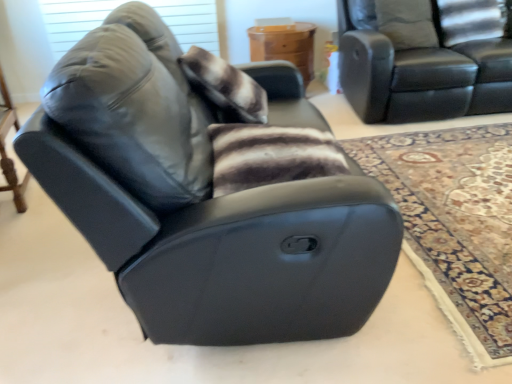
Question: Considering their positions, is matte gray window screen at upper left located in front of or behind black leather couch at upper right?

Choices:
 (A) front
 (B) behind

Answer: (B)

Question: Is matte gray window screen at upper left inside or outside of black leather couch at upper right?

Choices:
 (A) inside
 (B) outside

Answer: (B)

Question: Estimate the real-world distances between objects in this image. Which object is farther from the matte gray window screen at upper left?

Choices:
 (A) black leather recliner at center
 (B) black leather couch at upper right
 (C) carpeted rug at lower right
 (D) brown fur blanket at center
 (E) fuzzy brown pillow at upper center

Answer: (A)

Question: Based on their relative distances, which object is farther from the matte gray window screen at upper left?

Choices:
 (A) brown fur blanket at center
 (B) carpeted rug at lower right
 (C) fuzzy brown pillow at upper center
 (D) wooden table at center, the 1th table from the right
 (E) black leather recliner at center

Answer: (E)